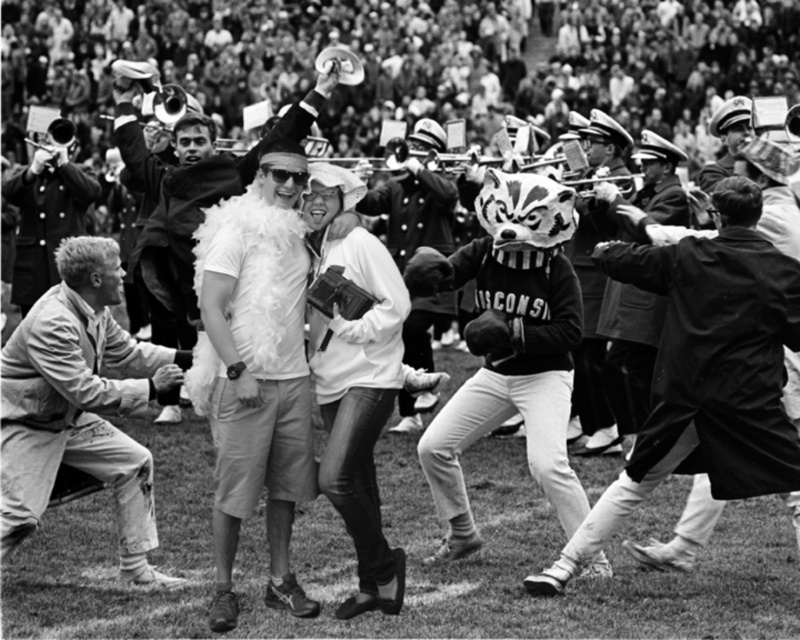
Does point (736, 380) lie in front of point (380, 209)?

Yes, point (736, 380) is closer to viewer.

Does smooth black coat at right appear on the left side of white fluffy boa at center?

Incorrect, smooth black coat at right is not on the left side of white fluffy boa at center.

Does point (600, 513) come behind point (402, 429)?

No, (600, 513) is in front of (402, 429).

The height and width of the screenshot is (640, 800). Find the location of `smooth black coat at right`. smooth black coat at right is located at coordinates (705, 371).

Can you confirm if light beige cotton jacket at lower left is wider than white feather boa at center?

No.

Does point (17, 419) come farther from viewer compared to point (202, 205)?

No, (17, 419) is closer to viewer.

Which is behind, point (102, 403) or point (172, 266)?

Point (172, 266)

Locate an element on the screen. The height and width of the screenshot is (640, 800). light beige cotton jacket at lower left is located at coordinates (81, 404).

Who is lower down, white feather boa at center or white fluffy boa at center?

white fluffy boa at center is below.

Between white feather boa at center and white fluffy boa at center, which one is positioned higher?

Positioned higher is white feather boa at center.

This screenshot has height=640, width=800. I want to click on white feather boa at center, so click(192, 184).